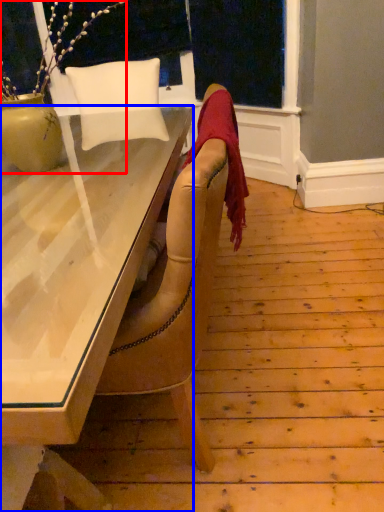
Question: Which object appears farthest to the camera in this image, houseplant (highlighted by a red box) or desk (highlighted by a blue box)?

Choices:
 (A) houseplant
 (B) desk

Answer: (A)